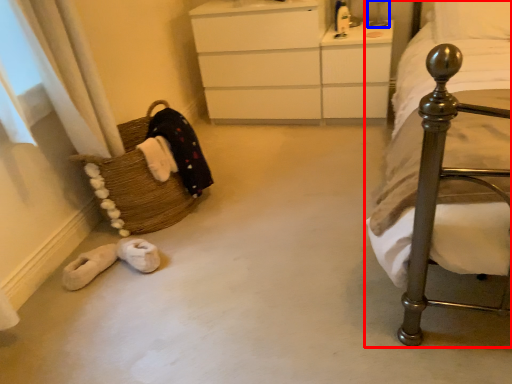
Question: Which point is closer to the camera, bed (highlighted by a red box) or table lamp (highlighted by a blue box)?

Choices:
 (A) bed
 (B) table lamp

Answer: (A)